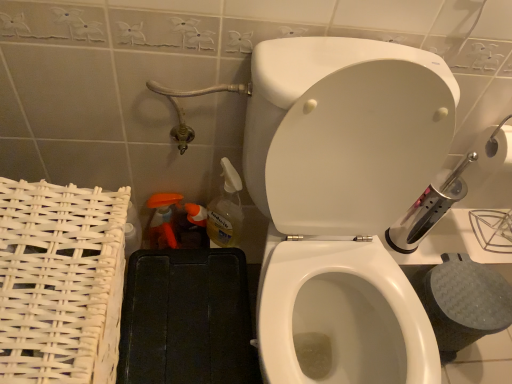
This screenshot has width=512, height=384. What do you see at coordinates (226, 209) in the screenshot?
I see `translucent plastic spray bottle at lower center, which is the 3th cleaning product from left to right` at bounding box center [226, 209].

Find the location of a particular element. translucent plastic spray bottle at lower center, placed as the 1th cleaning product when sorted from right to left is located at coordinates (226, 209).

Can you confirm if orange plastic spray bottle at lower left, acting as the second cleaning product starting from the left, is bigger than white wicker basket at left?

No.

Is orange plastic spray bottle at lower left, the 2th cleaning product when ordered from right to left, positioned with its back to white wicker basket at left?

No, white wicker basket at left is not at the back of orange plastic spray bottle at lower left, the 2th cleaning product when ordered from right to left.

Consider the image. Is orange plastic spray bottle at lower left, acting as the second cleaning product starting from the left, inside or outside of white wicker basket at left?

orange plastic spray bottle at lower left, acting as the second cleaning product starting from the left, exists outside the volume of white wicker basket at left.

Does orange plastic spray bottle at lower left, acting as the second cleaning product starting from the left, have a lesser width compared to white wicker basket at left?

Indeed, orange plastic spray bottle at lower left, acting as the second cleaning product starting from the left, has a lesser width compared to white wicker basket at left.

Locate an element on the screen. The image size is (512, 384). cleaning product that is the 3rd one when counting upward from the white wicker basket at left (from the image's perspective) is located at coordinates (226, 209).

In the scene shown: Considering the relative sizes of translucent plastic spray bottle at lower center, which is the 3th cleaning product from left to right, and white wicker basket at left in the image provided, is translucent plastic spray bottle at lower center, which is the 3th cleaning product from left to right, shorter than white wicker basket at left?

Indeed, translucent plastic spray bottle at lower center, which is the 3th cleaning product from left to right, has a lesser height compared to white wicker basket at left.

Which object is closer to the camera, translucent plastic spray bottle at lower center, which is the 3th cleaning product from left to right, or white wicker basket at left?

Positioned in front is white wicker basket at left.

Which object is thinner, translucent plastic spray bottle at lower center, placed as the 1th cleaning product when sorted from right to left, or white wicker basket at left?

translucent plastic spray bottle at lower center, placed as the 1th cleaning product when sorted from right to left, is thinner.

From the picture: Considering the relative sizes of translucent plastic spray bottle at lower left, which is counted as the 1th cleaning product, starting from the left, and orange plastic spray bottle at lower left, the 2th cleaning product when ordered from right to left, in the image provided, is translucent plastic spray bottle at lower left, which is counted as the 1th cleaning product, starting from the left, wider than orange plastic spray bottle at lower left, the 2th cleaning product when ordered from right to left,?

In fact, translucent plastic spray bottle at lower left, which is counted as the 1th cleaning product, starting from the left, might be narrower than orange plastic spray bottle at lower left, the 2th cleaning product when ordered from right to left.

From a real-world perspective, is translucent plastic spray bottle at lower left, which is counted as the 3th cleaning product, starting from the right, physically above orange plastic spray bottle at lower left, acting as the second cleaning product starting from the left?

Indeed, from a real-world perspective, translucent plastic spray bottle at lower left, which is counted as the 3th cleaning product, starting from the right, stands above orange plastic spray bottle at lower left, acting as the second cleaning product starting from the left.

From the image's perspective, which object appears higher, translucent plastic spray bottle at lower left, which is counted as the 3th cleaning product, starting from the right, or orange plastic spray bottle at lower left, acting as the second cleaning product starting from the left?

translucent plastic spray bottle at lower left, which is counted as the 3th cleaning product, starting from the right, is shown above in the image.

The width and height of the screenshot is (512, 384). What are the coordinates of `cleaning product on the left side of orange plastic spray bottle at lower left, the 2th cleaning product when ordered from right to left` in the screenshot? It's located at (163, 220).

From the image's perspective, who appears lower, white glossy toilet at center or white wicker basket at left?

white wicker basket at left is shown below in the image.

Would you say white glossy toilet at center is inside or outside white wicker basket at left?

white glossy toilet at center exists outside the volume of white wicker basket at left.

Is white glossy toilet at center far from white wicker basket at left?

No, white glossy toilet at center is not far from white wicker basket at left.

Is point (385, 157) positioned behind point (32, 257)?

Yes, point (385, 157) is behind point (32, 257).

In the image, is translucent plastic spray bottle at lower center, placed as the 1th cleaning product when sorted from right to left, on the left side or the right side of translucent plastic spray bottle at lower left, which is counted as the 3th cleaning product, starting from the right?

In the image, translucent plastic spray bottle at lower center, placed as the 1th cleaning product when sorted from right to left, appears on the right side of translucent plastic spray bottle at lower left, which is counted as the 3th cleaning product, starting from the right.

Considering the sizes of objects translucent plastic spray bottle at lower center, placed as the 1th cleaning product when sorted from right to left, and translucent plastic spray bottle at lower left, which is counted as the 3th cleaning product, starting from the right, in the image provided, who is taller, translucent plastic spray bottle at lower center, placed as the 1th cleaning product when sorted from right to left, or translucent plastic spray bottle at lower left, which is counted as the 3th cleaning product, starting from the right,?

translucent plastic spray bottle at lower center, placed as the 1th cleaning product when sorted from right to left, is taller.

Between translucent plastic spray bottle at lower center, which is the 3th cleaning product from left to right, and translucent plastic spray bottle at lower left, which is counted as the 1th cleaning product, starting from the left, which one has larger size?

Bigger between the two is translucent plastic spray bottle at lower center, which is the 3th cleaning product from left to right.

Is translucent plastic spray bottle at lower center, which is the 3th cleaning product from left to right, looking in the opposite direction of translucent plastic spray bottle at lower left, which is counted as the 1th cleaning product, starting from the left?

translucent plastic spray bottle at lower center, which is the 3th cleaning product from left to right, is not turned away from translucent plastic spray bottle at lower left, which is counted as the 1th cleaning product, starting from the left.

Does point (182, 224) appear closer or farther from the camera than point (230, 216)?

Clearly, point (182, 224) is more distant from the camera than point (230, 216).

From the image's perspective, between orange plastic spray bottle at lower left, the 2th cleaning product when ordered from right to left, and translucent plastic spray bottle at lower center, which is the 3th cleaning product from left to right, which one is located above?

translucent plastic spray bottle at lower center, which is the 3th cleaning product from left to right, appears higher in the image.

From a real-world perspective, is orange plastic spray bottle at lower left, the 2th cleaning product when ordered from right to left, positioned under translucent plastic spray bottle at lower center, which is the 3th cleaning product from left to right, based on gravity?

Yes, from a real-world perspective, orange plastic spray bottle at lower left, the 2th cleaning product when ordered from right to left, is beneath translucent plastic spray bottle at lower center, which is the 3th cleaning product from left to right.

Considering the sizes of objects orange plastic spray bottle at lower left, acting as the second cleaning product starting from the left, and translucent plastic spray bottle at lower center, which is the 3th cleaning product from left to right, in the image provided, who is shorter, orange plastic spray bottle at lower left, acting as the second cleaning product starting from the left, or translucent plastic spray bottle at lower center, which is the 3th cleaning product from left to right,?

Standing shorter between the two is orange plastic spray bottle at lower left, acting as the second cleaning product starting from the left.

Considering the sizes of objects white wicker basket at left and white glossy toilet at center in the image provided, who is thinner, white wicker basket at left or white glossy toilet at center?

With smaller width is white wicker basket at left.

From the image's perspective, which is below, white wicker basket at left or white glossy toilet at center?

white wicker basket at left appears lower in the image.

Can you see white wicker basket at left touching white glossy toilet at center?

white wicker basket at left and white glossy toilet at center are clearly separated.

Would you say white wicker basket at left contains white glossy toilet at center?

Definitely not — white glossy toilet at center is not inside white wicker basket at left.

Image resolution: width=512 pixels, height=384 pixels. In order to click on basket located in front of the orange plastic spray bottle at lower left, acting as the second cleaning product starting from the left in this screenshot , I will do (x=60, y=282).

This screenshot has width=512, height=384. In order to click on basket below the translucent plastic spray bottle at lower center, which is the 3th cleaning product from left to right (from the image's perspective) in this screenshot , I will do `click(60, 282)`.

Estimate the real-world distances between objects in this image. Which object is further from white wicker basket at left, orange plastic spray bottle at lower left, the 2th cleaning product when ordered from right to left, or white glossy toilet at center?

orange plastic spray bottle at lower left, the 2th cleaning product when ordered from right to left, lies further to white wicker basket at left than the other object.

Based on their spatial positions, is translucent plastic spray bottle at lower center, which is the 3th cleaning product from left to right, or white glossy toilet at center closer to orange plastic spray bottle at lower left, acting as the second cleaning product starting from the left?

translucent plastic spray bottle at lower center, which is the 3th cleaning product from left to right, is positioned closer to the anchor orange plastic spray bottle at lower left, acting as the second cleaning product starting from the left.

From the image, which object appears to be farther from translucent plastic spray bottle at lower center, which is the 3th cleaning product from left to right, white wicker basket at left or white glossy toilet at center?

white wicker basket at left is positioned further to the anchor translucent plastic spray bottle at lower center, which is the 3th cleaning product from left to right.

Consider the image. Considering their positions, is orange plastic spray bottle at lower left, acting as the second cleaning product starting from the left, positioned further to translucent plastic spray bottle at lower left, which is counted as the 3th cleaning product, starting from the right, than white wicker basket at left?

white wicker basket at left is positioned further to the anchor translucent plastic spray bottle at lower left, which is counted as the 3th cleaning product, starting from the right.

Based on their spatial positions, is translucent plastic spray bottle at lower center, placed as the 1th cleaning product when sorted from right to left, or translucent plastic spray bottle at lower left, which is counted as the 3th cleaning product, starting from the right, closer to white wicker basket at left?

translucent plastic spray bottle at lower center, placed as the 1th cleaning product when sorted from right to left.

Considering their positions, is translucent plastic spray bottle at lower left, which is counted as the 3th cleaning product, starting from the right, positioned further to translucent plastic spray bottle at lower center, which is the 3th cleaning product from left to right, than white glossy toilet at center?

white glossy toilet at center is positioned further to the anchor translucent plastic spray bottle at lower center, which is the 3th cleaning product from left to right.

From the image, which object appears to be farther from orange plastic spray bottle at lower left, the 2th cleaning product when ordered from right to left, white wicker basket at left or translucent plastic spray bottle at lower left, which is counted as the 1th cleaning product, starting from the left?

white wicker basket at left is further to orange plastic spray bottle at lower left, the 2th cleaning product when ordered from right to left.

When comparing their distances from translucent plastic spray bottle at lower left, which is counted as the 1th cleaning product, starting from the left, does white glossy toilet at center or white wicker basket at left seem further?

Among the two, white glossy toilet at center is located further to translucent plastic spray bottle at lower left, which is counted as the 1th cleaning product, starting from the left.

At what (x,y) coordinates should I click in order to perform the action: click on cleaning product between white glossy toilet at center and orange plastic spray bottle at lower left, acting as the second cleaning product starting from the left, in the front-back direction. Please return your answer as a coordinate pair (x, y). Looking at the image, I should click on (226, 209).

Identify the location of basket between white glossy toilet at center and translucent plastic spray bottle at lower left, which is counted as the 3th cleaning product, starting from the right, from front to back. (60, 282).

Image resolution: width=512 pixels, height=384 pixels. In order to click on basket located between white glossy toilet at center and orange plastic spray bottle at lower left, acting as the second cleaning product starting from the left, in the depth direction in this screenshot , I will do `click(60, 282)`.

You are a GUI agent. You are given a task and a screenshot of the screen. Output one action in this format:
    pyautogui.click(x=<x>, y=<y>)
    Task: Click on the cleaning product between white wicker basket at left and orange plastic spray bottle at lower left, the 2th cleaning product when ordered from right to left, in the front-back direction
    This screenshot has height=384, width=512.
    Given the screenshot: What is the action you would take?
    pyautogui.click(x=226, y=209)